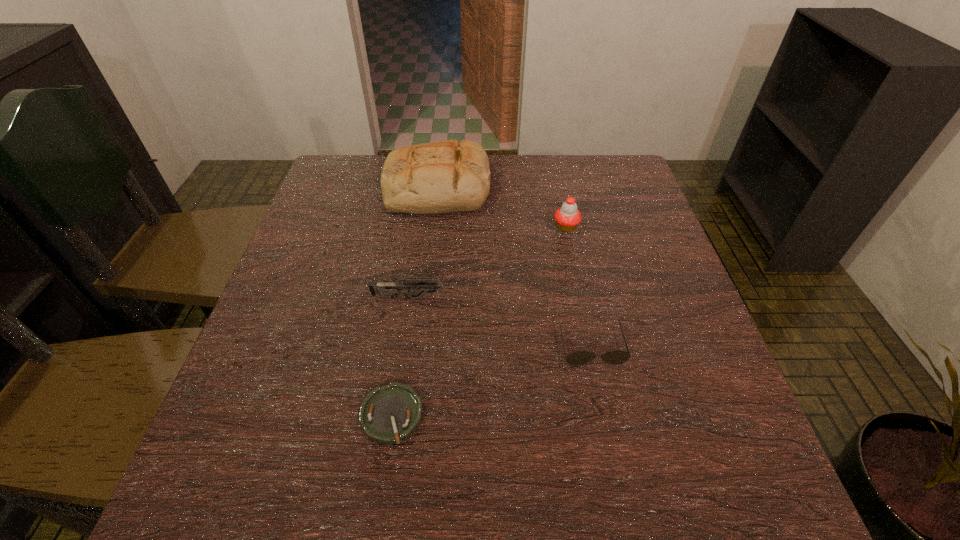
Where is `the tallest object`? The height and width of the screenshot is (540, 960). the tallest object is located at coordinates (440, 177).

Locate an element on the screen. The height and width of the screenshot is (540, 960). cupcake is located at coordinates (567, 217).

Image resolution: width=960 pixels, height=540 pixels. What are the coordinates of `the third farthest object` in the screenshot? It's located at (392, 288).

Locate an element on the screen. Image resolution: width=960 pixels, height=540 pixels. gun is located at coordinates (392, 288).

You are a GUI agent. You are given a task and a screenshot of the screen. Output one action in this format:
    pyautogui.click(x=<x>, y=<y>)
    Task: Click on the fourth tallest object
    The height and width of the screenshot is (540, 960).
    Given the screenshot: What is the action you would take?
    point(616,357)

You are a GUI agent. You are given a task and a screenshot of the screen. Output one action in this format:
    pyautogui.click(x=<x>, y=<y>)
    Task: Click on the second nearest object
    The image size is (960, 540).
    Given the screenshot: What is the action you would take?
    pyautogui.click(x=616, y=357)

Where is `the nearest object`? the nearest object is located at coordinates (390, 414).

Identify the location of ashtray. (390, 414).

This screenshot has width=960, height=540. In order to click on vacant space located on the right of the bread in this screenshot , I will do `click(559, 189)`.

Locate an element on the screen. blank space located on the right of the fourth shortest object is located at coordinates (636, 227).